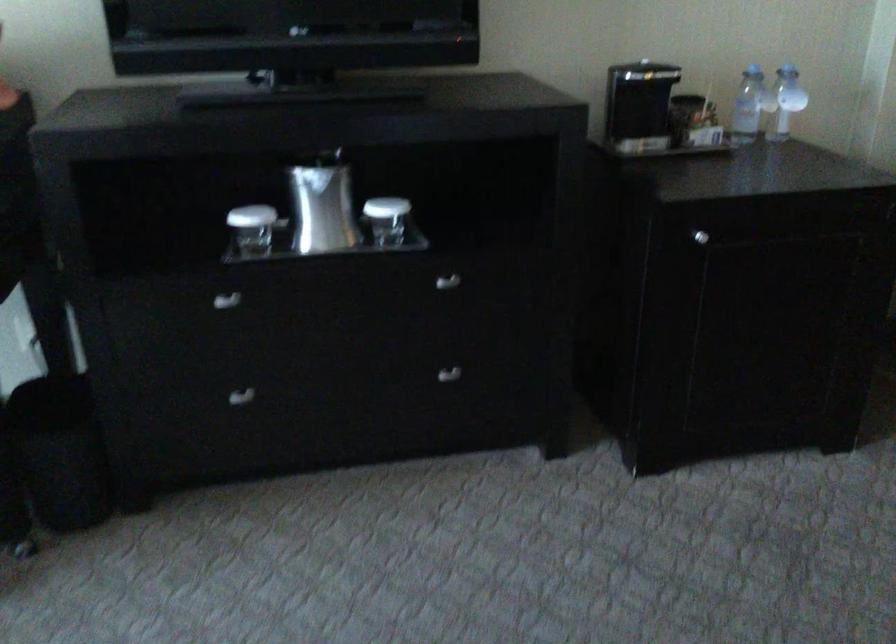
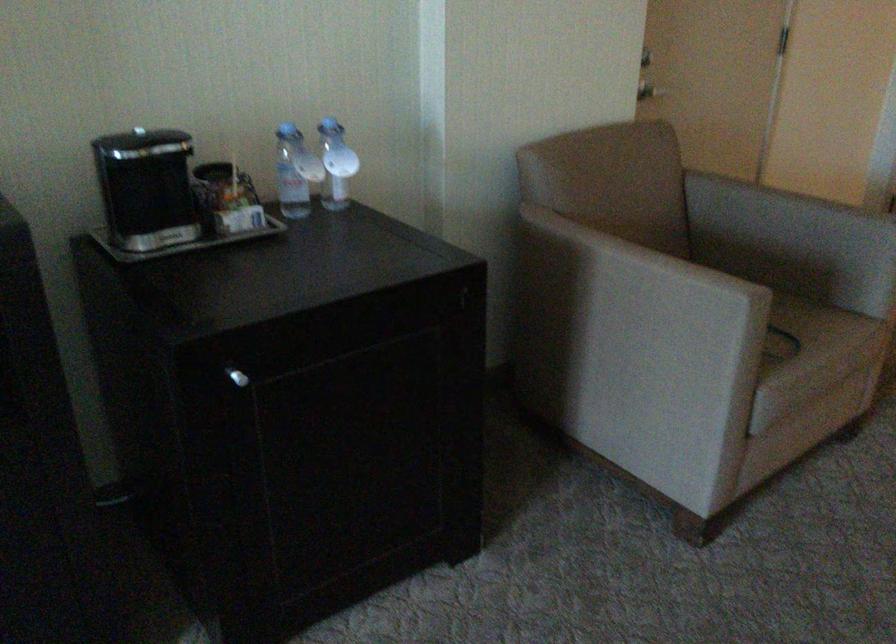
Find the pixel in the second image that matches point (794, 90) in the first image.

(336, 164)